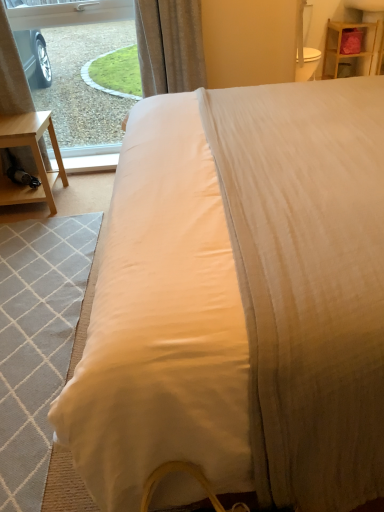
Image resolution: width=384 pixels, height=512 pixels. Find the location of `satin curtain at upper center`. satin curtain at upper center is located at coordinates click(170, 46).

Where is `wooden shelf at upper right`? wooden shelf at upper right is located at coordinates (340, 44).

What do you see at coordinates (82, 85) in the screenshot? I see `transparent glass window at upper left` at bounding box center [82, 85].

Find the location of `light gray woven mat at lower left`. light gray woven mat at lower left is located at coordinates (37, 341).

From the image's perspective, is wooden shelf at upper right on top of satin curtain at upper center?

Yes, from the image's perspective, wooden shelf at upper right is above satin curtain at upper center.

From a real-world perspective, relative to satin curtain at upper center, is wooden shelf at upper right vertically above or below?

From a real-world perspective, wooden shelf at upper right is physically below satin curtain at upper center.

Which is more to the left, wooden shelf at upper right or satin curtain at upper center?

satin curtain at upper center.

Is wooden shelf at upper right positioned far away from satin curtain at upper center?

Absolutely, wooden shelf at upper right is distant from satin curtain at upper center.

Between satin curtain at upper center and light gray woven mat at lower left, which one has larger width?

light gray woven mat at lower left.

Considering the sizes of objects satin curtain at upper center and light gray woven mat at lower left in the image provided, who is taller, satin curtain at upper center or light gray woven mat at lower left?

Standing taller between the two is satin curtain at upper center.

Consider the image. Which is farther, [152,42] or [35,320]?

Point [152,42]

Considering the sizes of satin curtain at upper center and light gray woven mat at lower left in the image, is satin curtain at upper center bigger or smaller than light gray woven mat at lower left?

In the image, satin curtain at upper center appears to be larger than light gray woven mat at lower left.

This screenshot has width=384, height=512. I want to click on nightstand lying above the transparent glass window at upper left (from the image's perspective), so click(x=340, y=44).

Is wooden shelf at upper right oriented away from transparent glass window at upper left?

No, wooden shelf at upper right is not facing the opposite direction of transparent glass window at upper left.

Relative to transparent glass window at upper left, is wooden shelf at upper right in front or behind?

In the image, wooden shelf at upper right appears behind transparent glass window at upper left.

Is wooden shelf at upper right bigger than transparent glass window at upper left?

No.

Consider the image. Is light gray woven mat at lower left thinner than wooden shelf at upper right?

No, light gray woven mat at lower left is not thinner than wooden shelf at upper right.

Is light gray woven mat at lower left positioned in front of wooden shelf at upper right?

That is True.

Is wooden shelf at upper right at the back of light gray woven mat at lower left?

No.

From the image's perspective, is light gray woven mat at lower left located above or below wooden shelf at upper right?

Clearly, from the image's perspective, light gray woven mat at lower left is below wooden shelf at upper right.

Looking at their sizes, would you say transparent glass window at upper left is wider or thinner than satin curtain at upper center?

In the image, transparent glass window at upper left appears to be more narrow than satin curtain at upper center.

Find the location of a particular element. The width and height of the screenshot is (384, 512). window screen located on the left of satin curtain at upper center is located at coordinates (82, 85).

Is point (69, 34) closer to viewer compared to point (143, 31)?

No.

Measure the distance from transparent glass window at upper left to satin curtain at upper center.

They are 58.33 centimeters apart.

How different are the orientations of satin curtain at upper center and wooden shelf at upper right in degrees?

The angle between the facing direction of satin curtain at upper center and the facing direction of wooden shelf at upper right is 2.58 degrees.

Is satin curtain at upper center looking in the opposite direction of wooden shelf at upper right?

No.

Is satin curtain at upper center far from wooden shelf at upper right?

satin curtain at upper center is positioned a significant distance from wooden shelf at upper right.

Is point (177, 83) positioned behind point (375, 35)?

No, it is in front of (375, 35).

From a real-world perspective, relative to satin curtain at upper center, is light gray woven mat at lower left vertically above or below?

From a real-world perspective, light gray woven mat at lower left is physically below satin curtain at upper center.

Is light gray woven mat at lower left oriented away from satin curtain at upper center?

No, light gray woven mat at lower left is not facing away from satin curtain at upper center.

Is point (64, 342) closer or farther from the camera than point (176, 60)?

Point (64, 342).

Consider the image. From the image's perspective, would you say light gray woven mat at lower left is positioned over satin curtain at upper center?

Incorrect, from the image's perspective, light gray woven mat at lower left is lower than satin curtain at upper center.

Locate an element on the screen. Image resolution: width=384 pixels, height=512 pixels. nightstand behind the satin curtain at upper center is located at coordinates (340, 44).

What are the coordinates of `mat lying below the satin curtain at upper center (from the image's perspective)` in the screenshot? It's located at (37, 341).

Looking at this image, estimate the real-world distances between objects in this image. Which object is further from transparent glass window at upper left, satin curtain at upper center or wooden shelf at upper right?

wooden shelf at upper right.

From the image, which object appears to be farther from light gray woven mat at lower left, satin curtain at upper center or transparent glass window at upper left?

The object further to light gray woven mat at lower left is transparent glass window at upper left.

From the image, which object appears to be farther from transparent glass window at upper left, satin curtain at upper center or light gray woven mat at lower left?

light gray woven mat at lower left is further to transparent glass window at upper left.

Based on their spatial positions, is transparent glass window at upper left or wooden shelf at upper right closer to light gray woven mat at lower left?

Among the two, transparent glass window at upper left is located nearer to light gray woven mat at lower left.

Estimate the real-world distances between objects in this image. Which object is further from transparent glass window at upper left, wooden shelf at upper right or light gray woven mat at lower left?

wooden shelf at upper right is positioned further to the anchor transparent glass window at upper left.

When comparing their distances from satin curtain at upper center, does light gray woven mat at lower left or wooden shelf at upper right seem closer?

The object closer to satin curtain at upper center is light gray woven mat at lower left.

Looking at the image, which one is located further to wooden shelf at upper right, transparent glass window at upper left or satin curtain at upper center?

transparent glass window at upper left.

Looking at this image, considering their positions, is light gray woven mat at lower left positioned further to wooden shelf at upper right than transparent glass window at upper left?

light gray woven mat at lower left is further to wooden shelf at upper right.

You are a GUI agent. You are given a task and a screenshot of the screen. Output one action in this format:
    pyautogui.click(x=<x>, y=<y>)
    Task: Click on the curtain between transparent glass window at upper left and wooden shelf at upper right from left to right
    This screenshot has width=384, height=512.
    Given the screenshot: What is the action you would take?
    (170, 46)

Find the location of a particular element. The image size is (384, 512). window screen between light gray woven mat at lower left and wooden shelf at upper right from front to back is located at coordinates (82, 85).

Image resolution: width=384 pixels, height=512 pixels. In order to click on window screen between satin curtain at upper center and light gray woven mat at lower left in the up-down direction in this screenshot , I will do pos(82,85).

Identify the location of curtain located between light gray woven mat at lower left and wooden shelf at upper right in the depth direction. (170, 46).